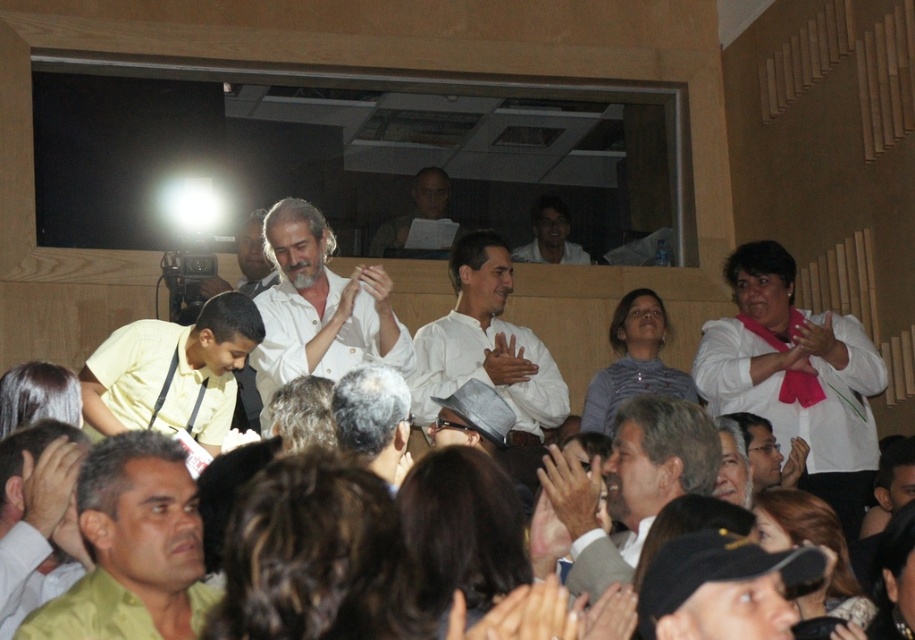
You are standing at the entrance of the auditorium and notice a person wearing a matte yellow shirt at lower left. Can you determine the exact coordinates of where this person is located in the room?

The matte yellow shirt at lower left is located at point [133,547].

You are standing in the auditorium and want to take a photo of both point (386, 397) and point (513, 250) in the image. Since you want both points to be in focus, which point should you focus on to ensure the other is also sharp?

You should focus on point (513, 250) because it is farther from the camera than point (386, 397). By focusing on the farther point, the closer point will also be within the depth of field, ensuring both are sharp.

You are standing in the auditorium and see the point at coordinates (133, 547). What object is located there?

The matte yellow shirt at lower left is located at point (133, 547).